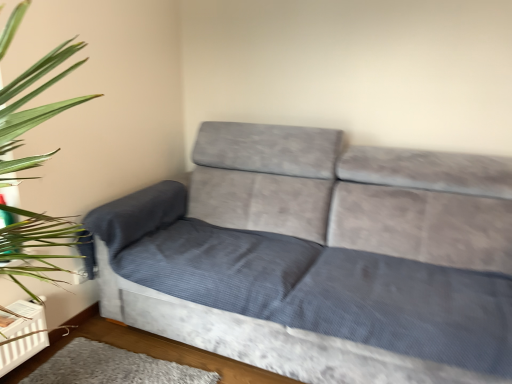
Question: Should I look upward or downward to see gray soft rug at lower center?

Choices:
 (A) up
 (B) down

Answer: (B)

Question: Is gray soft rug at lower center a part of velvet gray couch at center?

Choices:
 (A) yes
 (B) no

Answer: (B)

Question: Are velvet gray couch at center and gray soft rug at lower center making contact?

Choices:
 (A) no
 (B) yes

Answer: (A)

Question: Can you confirm if velvet gray couch at center is positioned to the right of gray soft rug at lower center?

Choices:
 (A) yes
 (B) no

Answer: (A)

Question: Is the depth of velvet gray couch at center greater than that of gray soft rug at lower center?

Choices:
 (A) no
 (B) yes

Answer: (A)

Question: Is velvet gray couch at center far from gray soft rug at lower center?

Choices:
 (A) no
 (B) yes

Answer: (A)

Question: Is velvet gray couch at center smaller than gray soft rug at lower center?

Choices:
 (A) yes
 (B) no

Answer: (B)

Question: Would you say gray soft rug at lower center is outside velvet gray couch at center?

Choices:
 (A) no
 (B) yes

Answer: (B)

Question: Is gray soft rug at lower center facing away from velvet gray couch at center?

Choices:
 (A) yes
 (B) no

Answer: (A)

Question: From the image's perspective, is gray soft rug at lower center below velvet gray couch at center?

Choices:
 (A) no
 (B) yes

Answer: (B)

Question: From the image's perspective, would you say gray soft rug at lower center is positioned over velvet gray couch at center?

Choices:
 (A) yes
 (B) no

Answer: (B)

Question: Can you confirm if gray soft rug at lower center is positioned to the left of velvet gray couch at center?

Choices:
 (A) yes
 (B) no

Answer: (A)

Question: Is there a large distance between gray soft rug at lower center and velvet gray couch at center?

Choices:
 (A) yes
 (B) no

Answer: (B)

Question: Visually, is velvet gray couch at center positioned to the left or to the right of gray soft rug at lower center?

Choices:
 (A) left
 (B) right

Answer: (B)